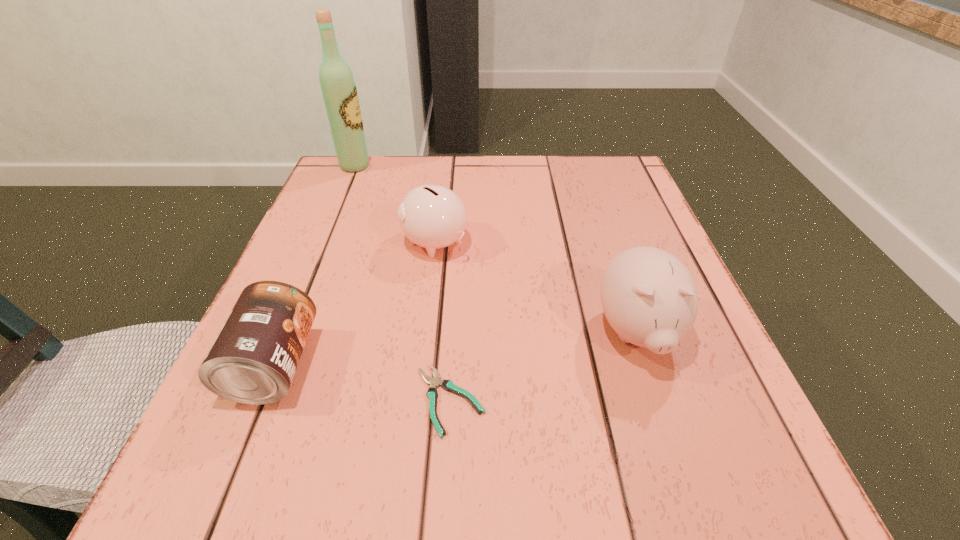
Find the location of a particular element. unoccupied area between the pliers and the wine bottle is located at coordinates (402, 283).

Identify the location of unoccupied area between the can and the pliers. (362, 382).

You are a GUI agent. You are given a task and a screenshot of the screen. Output one action in this format:
    pyautogui.click(x=<x>, y=<y>)
    Task: Click on the unoccupied area between the rightmost object and the fourth nearest object
    
    Given the screenshot: What is the action you would take?
    pyautogui.click(x=536, y=287)

The height and width of the screenshot is (540, 960). In order to click on vacant point located between the shortest object and the shorter piggy bank in this screenshot , I will do `click(443, 321)`.

Identify the location of vacant space that's between the pliers and the can. (362, 382).

At what (x,y) coordinates should I click in order to perform the action: click on the closest object to the farther piggy bank. Please return your answer as a coordinate pair (x, y). This screenshot has height=540, width=960. Looking at the image, I should click on click(x=253, y=360).

This screenshot has width=960, height=540. What are the coordinates of `object that ranks as the third closest to the farthest object` in the screenshot? It's located at (448, 385).

Locate an element on the screen. This screenshot has height=540, width=960. vacant space that satisfies the following two spatial constraints: 1. on the front-facing side of the second farthest object; 2. on the right side of the farthest object is located at coordinates (324, 242).

You are a GUI agent. You are given a task and a screenshot of the screen. Output one action in this format:
    pyautogui.click(x=<x>, y=<y>)
    Task: Click on the free space that satisfies the following two spatial constraints: 1. at the snout of the rightmost object; 2. on the front label of the can
    The image size is (960, 540).
    Given the screenshot: What is the action you would take?
    pyautogui.click(x=647, y=364)

At what (x,y) coordinates should I click in order to perform the action: click on vacant space that satisfies the following two spatial constraints: 1. on the front side of the fourth nearest object; 2. on the front label of the can. Please return your answer as a coordinate pair (x, y). The height and width of the screenshot is (540, 960). Looking at the image, I should click on (420, 364).